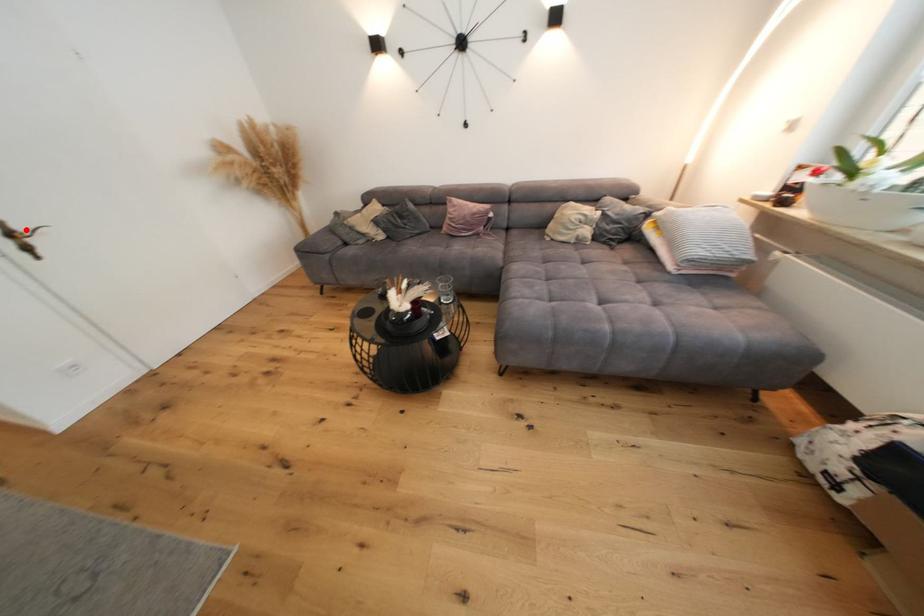
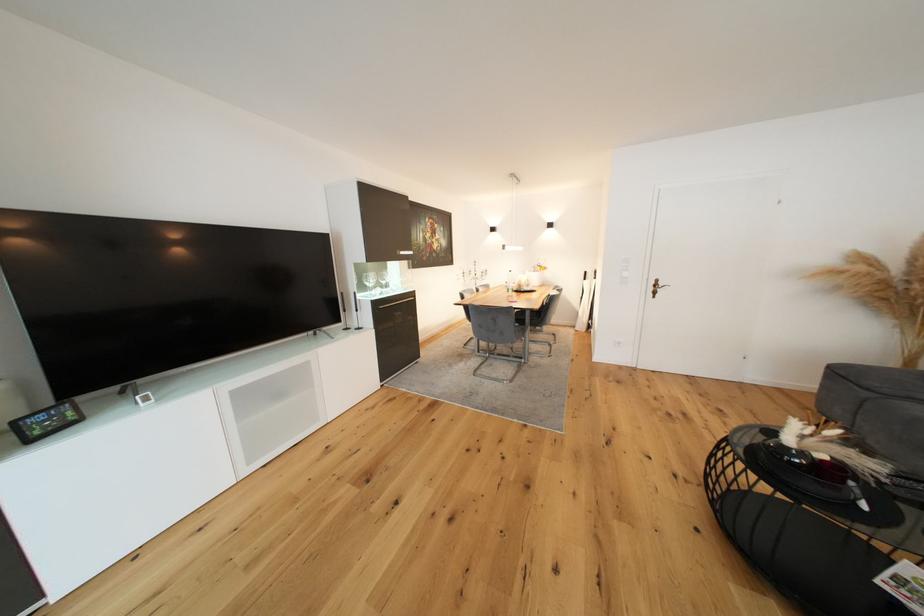
Question: I am providing you with two images of the same scene from different viewpoints. A red point is marked on the first image. Is the red point's position out of view in image 2?

Choices:
 (A) Yes
 (B) No

Answer: (B)